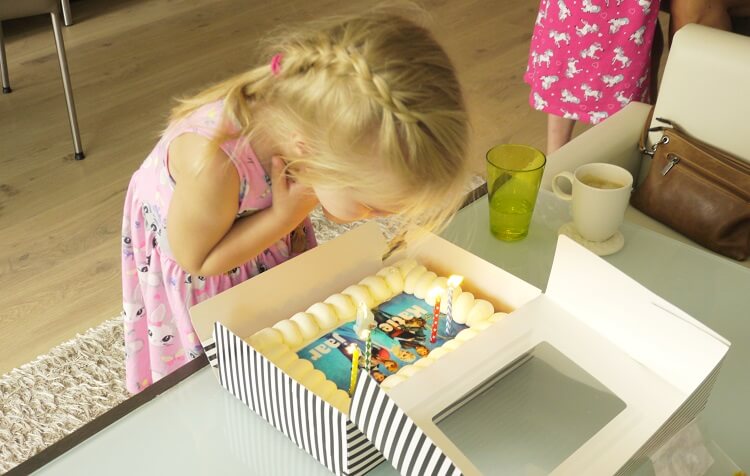
Where is `white coffee cup`? The height and width of the screenshot is (476, 750). white coffee cup is located at coordinates (592, 217).